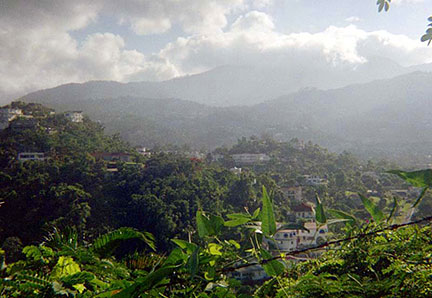
Where is `\plants hanging down`? \plants hanging down is located at coordinates (381, 4), (429, 38).